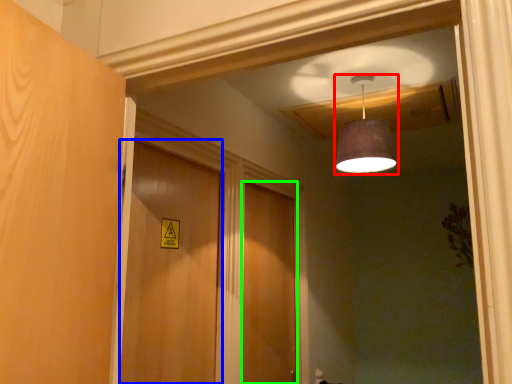
Question: Which object is positioned farthest from lamp (highlighted by a red box)? Select from door (highlighted by a blue box) and door (highlighted by a green box).

Choices:
 (A) door
 (B) door

Answer: (B)